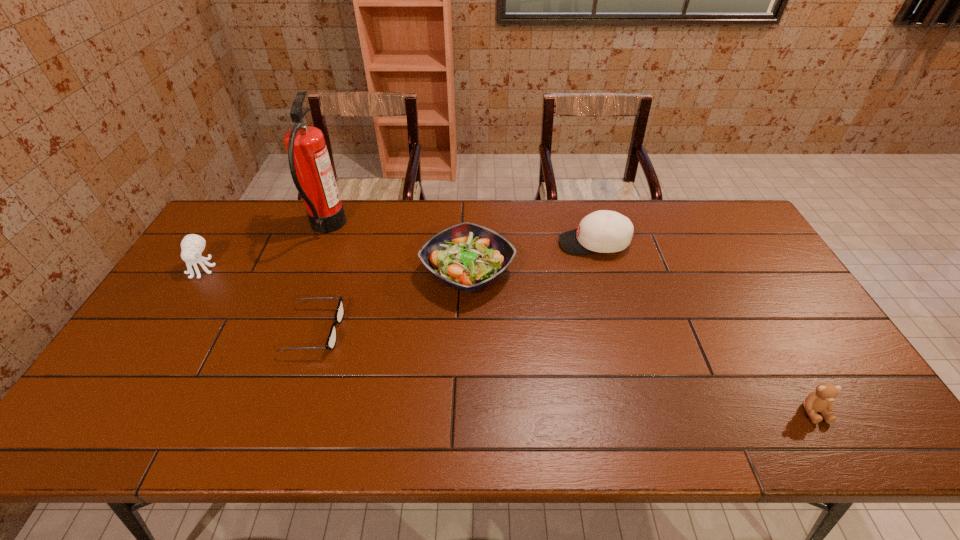
What are the coordinates of `fire extinguisher` in the screenshot? It's located at (311, 170).

Locate an element on the screen. The image size is (960, 540). the second object from right to left is located at coordinates (603, 231).

This screenshot has width=960, height=540. I want to click on the leftmost object, so click(x=192, y=245).

Locate an element on the screen. The height and width of the screenshot is (540, 960). the third object from right to left is located at coordinates (468, 257).

Locate an element on the screen. This screenshot has height=540, width=960. teddy bear is located at coordinates (821, 400).

The image size is (960, 540). Find the location of `the second shortest object`. the second shortest object is located at coordinates (821, 400).

This screenshot has width=960, height=540. In order to click on the shortest object in this screenshot , I will do `click(331, 341)`.

Where is `vacant point located 0.270m on the front-facing side of the fire extinguisher`? The width and height of the screenshot is (960, 540). vacant point located 0.270m on the front-facing side of the fire extinguisher is located at coordinates (423, 228).

I want to click on vacant position located on the front-facing side of the second object from right to left, so click(x=467, y=244).

The width and height of the screenshot is (960, 540). Identify the location of vacant area located on the front-facing side of the second object from right to left. (525, 244).